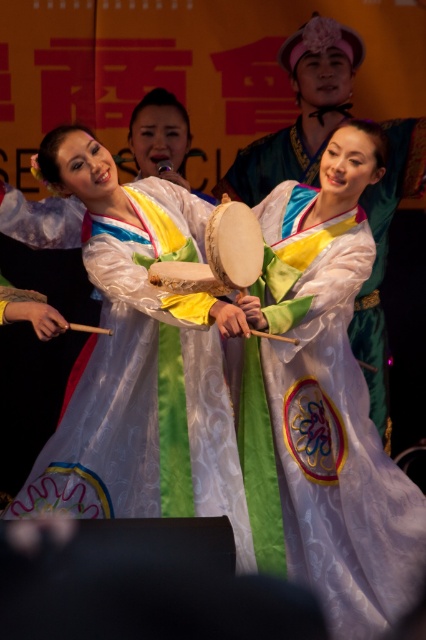
Question: Which object is the closest to the silky white robe at center?

Choices:
 (A) white satin dress at center
 (B) light brown wooden drum at center

Answer: (A)

Question: Considering the real-world distances, which object is farthest from the light brown wooden drum at center?

Choices:
 (A) white satin dress at center
 (B) silky white robe at center

Answer: (B)

Question: Considering the real-world distances, which object is closest to the silky white robe at center?

Choices:
 (A) white satin dress at center
 (B) light brown wooden drum at center

Answer: (A)

Question: Considering the relative positions of silky white robe at center and light brown wooden drum at center in the image provided, where is silky white robe at center located with respect to light brown wooden drum at center?

Choices:
 (A) below
 (B) above

Answer: (A)

Question: Is silky white robe at center above white satin dress at center?

Choices:
 (A) yes
 (B) no

Answer: (B)

Question: Does silky white robe at center appear on the right side of white satin dress at center?

Choices:
 (A) yes
 (B) no

Answer: (A)